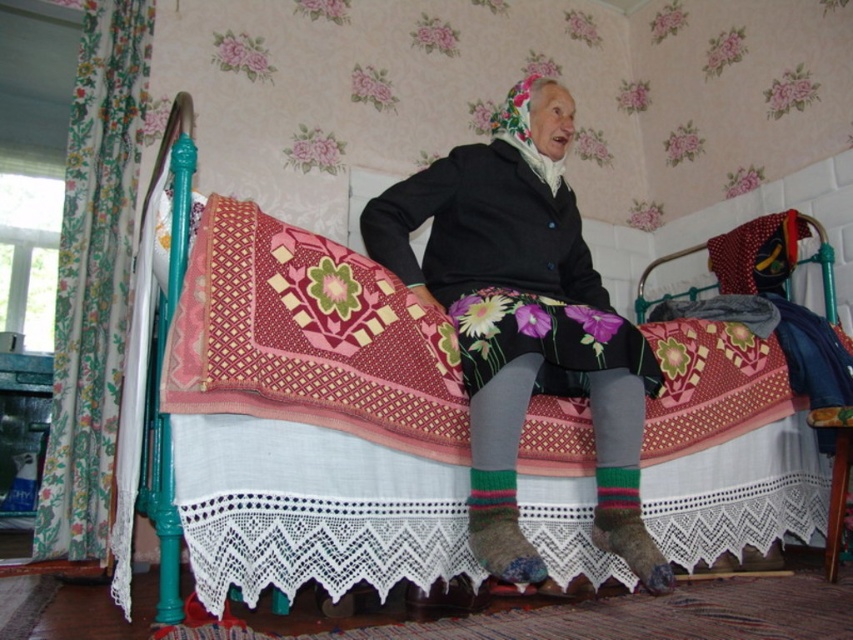
You are standing in the room and see the point marked at coordinates [317,461]. What object is located at that point?

The point at coordinates [317,461] corresponds to the pink fabric bed at center.

You are standing in the room and want to place a small plant between the two points, point 1 at (699, 353) and point 2 at (379, 230). Since you want the plant to be closer to the wall, which point should you choose?

Point 2 at (379, 230) is closer to the wall because point 1 at (699, 353) is behind it, meaning point 2 is nearer to the wall.